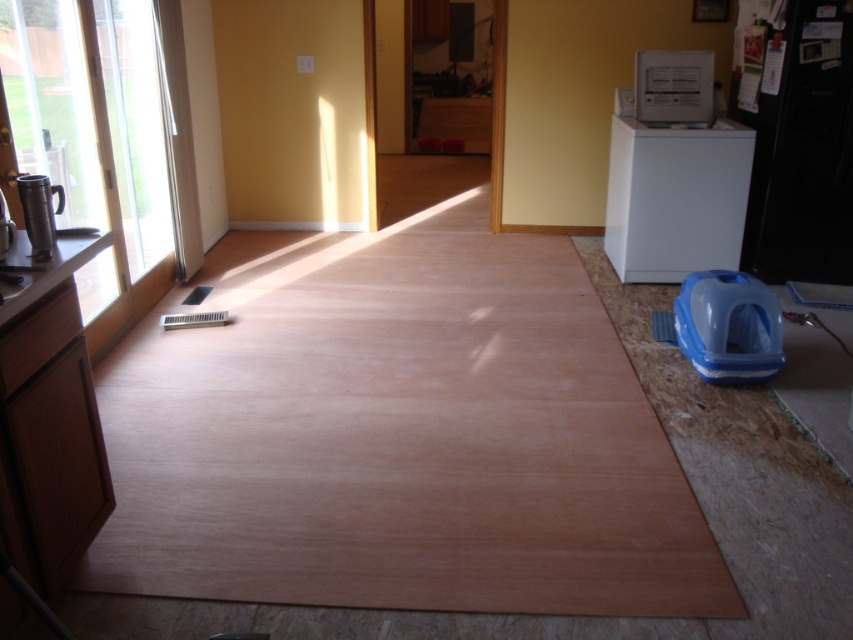
You are a delivery person who just arrived at the house to install a new appliance. You see the white glossy dishwasher at upper right and the blue plastic dish washer at lower right. Which one is taller?

The white glossy dishwasher at upper right is much taller than the blue plastic dish washer at lower right.

You are a delivery person who just arrived at the house and need to place a new microwave. The microwave is too big to fit in the kitchen, so you have to put it temporarily in the room shown. The white glossy dishwasher at upper right and the metallic silver coffee pot at left are already there. Which object should you place the microwave next to so it is closer to the door? Assume the door is on the opposite side of the room from the unfinished flooring.

The white glossy dishwasher at upper right is to the right of the metallic silver coffee pot at left. Since the door is opposite the unfinished flooring, placing the microwave next to the white glossy dishwasher at upper right would be closer to the door.

In the scene shown: You are a home renovator working in the room and need to access the metallic silver coffee pot at left. Can you reach it without moving the white glossy dishwasher at upper right?

The white glossy dishwasher at upper right is positioned over the metallic silver coffee pot at left, so you cannot reach the metallic silver coffee pot at left without moving the dishwasher.